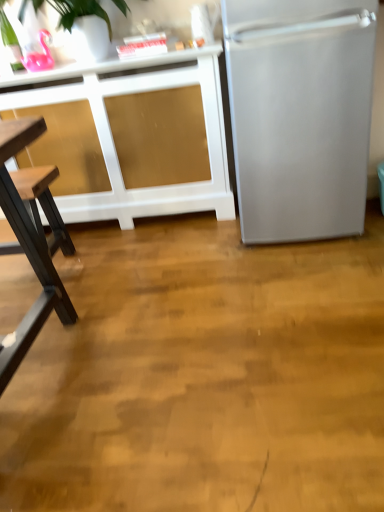
This screenshot has width=384, height=512. I want to click on vacant space in front of white matte cabinet at upper left, so click(x=140, y=283).